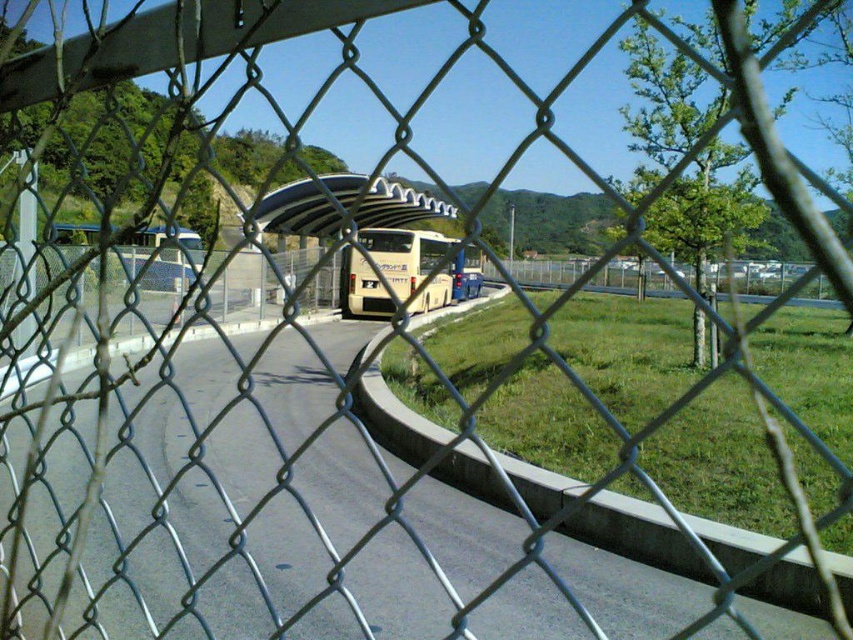
You are standing at the center of the image and want to walk towards the beige plastic bus stop at center. In which direction should you move?

The beige plastic bus stop at center is already at the center of the image, so you are already facing it directly. Move straight ahead.

You are a passenger waiting at the beige plastic bus stop at center. You look down and see the beige matte bus at center. Which object is closer to the ground?

The beige matte bus at center is closer to the ground because the beige plastic bus stop at center is above it.